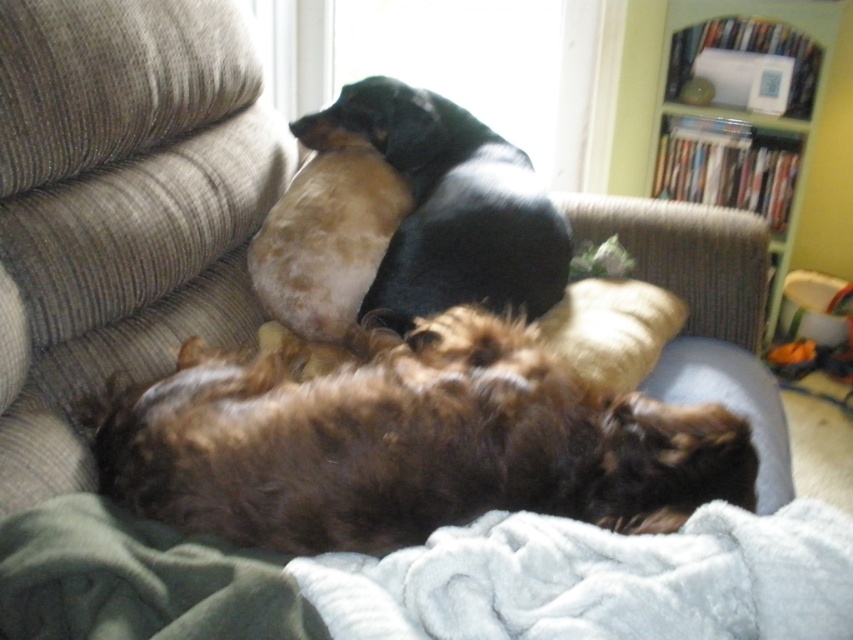
You are a dog owner trying to place a new rectangular dog bed that is 1.2 meters long. The bed needs to be placed between the brown shaggy dog at center and the soft blue blanket at lower center. Can the bed fit in that space?

The brown shaggy dog at center is taller than the soft blue blanket at lower center. Therefore, the space between them is at least 1.2 meters in length, so the dog bed can fit.

You are standing in the living room and want to place a small plant on the couch. The couch has limited space. The black smooth dog at upper center is currently occupying some of it. Where should you place the plant so it doesn not disturb the dog?

The black smooth dog at upper center is located at point (450, 205), so you should place the plant in an area of the couch not occupied by the dog, such as the far left or right end where there is more space available.

You are a pet sitter who needs to ensure the black smooth dog at upper center has enough space to stretch without touching the green plastic bookshelf at upper right. The dog requires 4 feet of space to stretch comfortably. Based on the scene, can the dog stretch comfortably?

The black smooth dog at upper center is 3.97 feet from the green plastic bookshelf at upper right. Since the required space is 4 feet, the dog does not have enough space to stretch comfortably without touching the bookshelf.